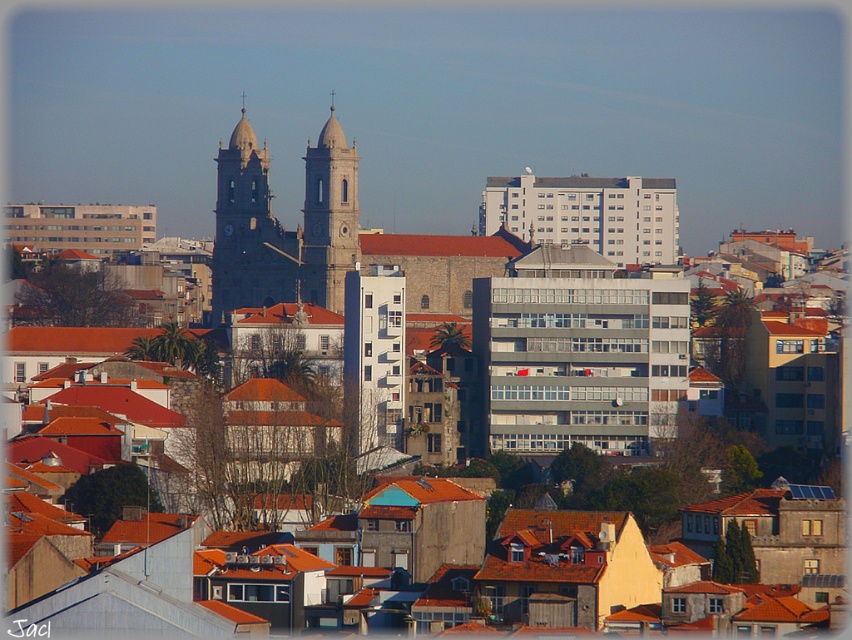
Question: Is dark gray stone tower at center to the left of light beige stone tower at center from the viewer's perspective?

Choices:
 (A) no
 (B) yes

Answer: (B)

Question: Can you confirm if dark gray stone tower at center is wider than light beige stone tower at center?

Choices:
 (A) no
 (B) yes

Answer: (B)

Question: Can you confirm if dark gray stone tower at center is bigger than light beige stone tower at center?

Choices:
 (A) no
 (B) yes

Answer: (B)